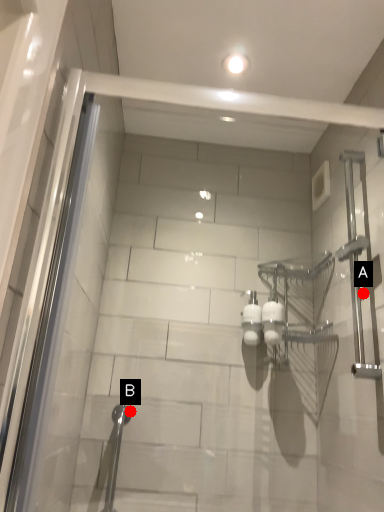
Question: Two points are circled on the image, labeled by A and B beside each circle. Which of the following is the closest to the observer?

Choices:
 (A) A is closer
 (B) B is closer

Answer: (A)